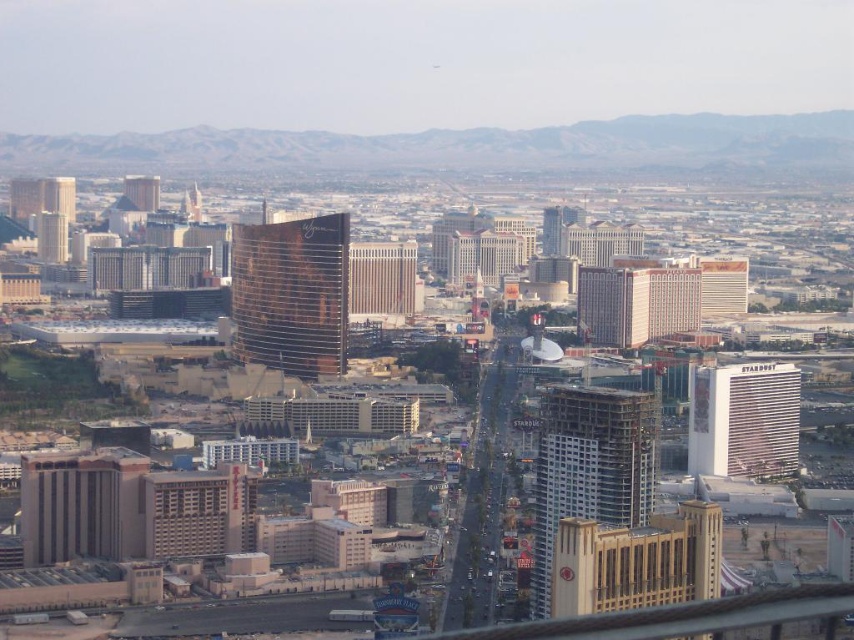
You are standing at the point labeled point (59, 250) and want to walk to the point labeled point (253, 326). Which direction should you move to get closer to your destination?

You should move forward because point (253, 326) is closer to the camera than point (59, 250), meaning it is in front of your current position.

You are standing on the rooftop of a building in the city and want to locate the rusty metal tower at center. According to the coordinate system where the bottom left corner of the image is the origin, can you determine its exact position?

The rusty metal tower at center is located at coordinates point (291, 292).